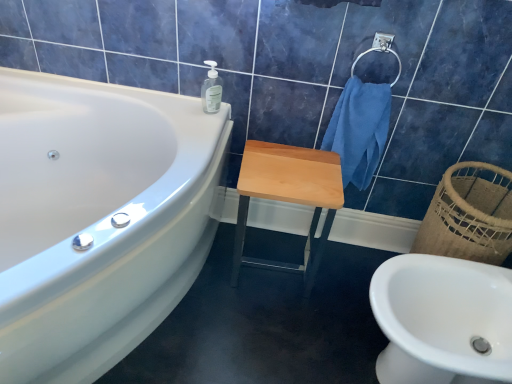
Where is `free point above light wood/matte stool at center (from a real-world perspective)`? This screenshot has height=384, width=512. free point above light wood/matte stool at center (from a real-world perspective) is located at coordinates (295, 166).